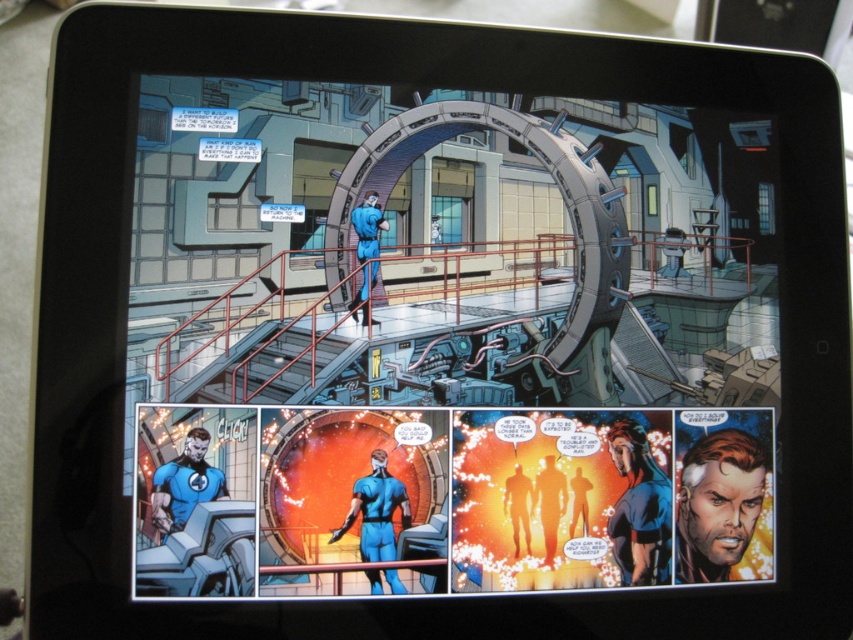
Question: Does blue glossy figure at center have a larger size compared to blue glossy suit at center?

Choices:
 (A) yes
 (B) no

Answer: (A)

Question: Which of the following is the closest to the observer?

Choices:
 (A) (201, 436)
 (B) (376, 452)

Answer: (A)

Question: Is blue glossy suit at center closer to camera compared to matte blue suit at bottom left?

Choices:
 (A) no
 (B) yes

Answer: (A)

Question: Which of the following is the closest to the observer?

Choices:
 (A) matte blue suit at bottom left
 (B) blue glossy figure at center

Answer: (A)

Question: Can you confirm if blue glossy figure at center is positioned to the left of matte blue suit at bottom left?

Choices:
 (A) yes
 (B) no

Answer: (B)

Question: Which object appears closest to the camera in this image?

Choices:
 (A) matte blue suit at bottom left
 (B) blue glossy figure at center
 (C) blue glossy suit at center

Answer: (A)